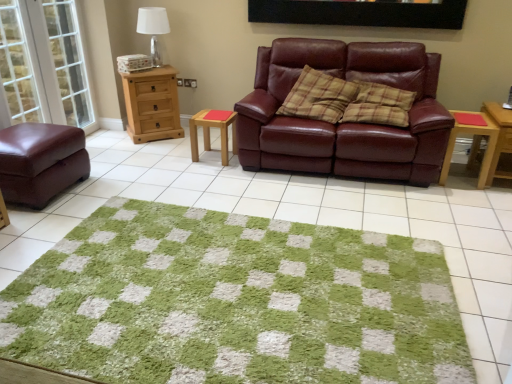
This screenshot has height=384, width=512. I want to click on free location to the right of burgundy leather ottoman at left, so click(x=112, y=183).